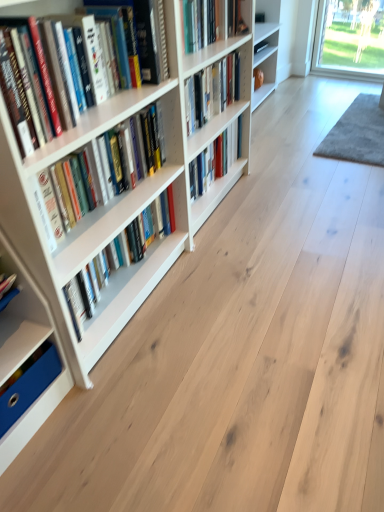
Locate an element on the screen. This screenshot has height=512, width=384. free point in front of white matte bookcase at left is located at coordinates (209, 370).